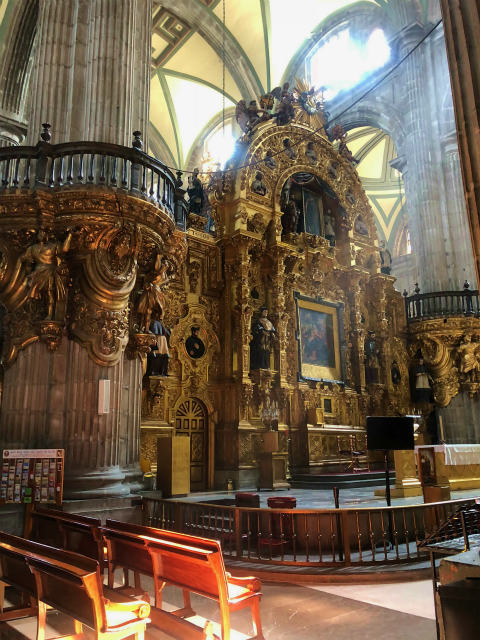
Where is `floor`? The width and height of the screenshot is (480, 640). floor is located at coordinates (288, 605).